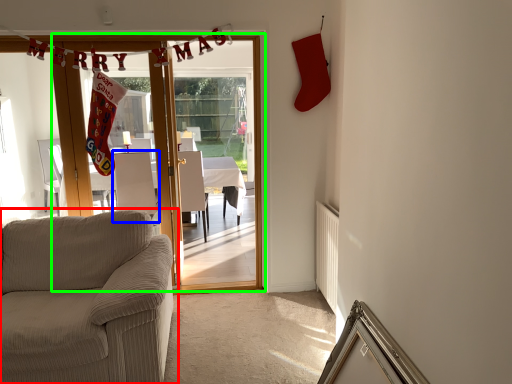
Question: Estimate the real-world distances between objects in this image. Which object is closer to studio couch (highlighted by a red box), armchair (highlighted by a blue box) or door (highlighted by a green box)?

Choices:
 (A) armchair
 (B) door

Answer: (B)